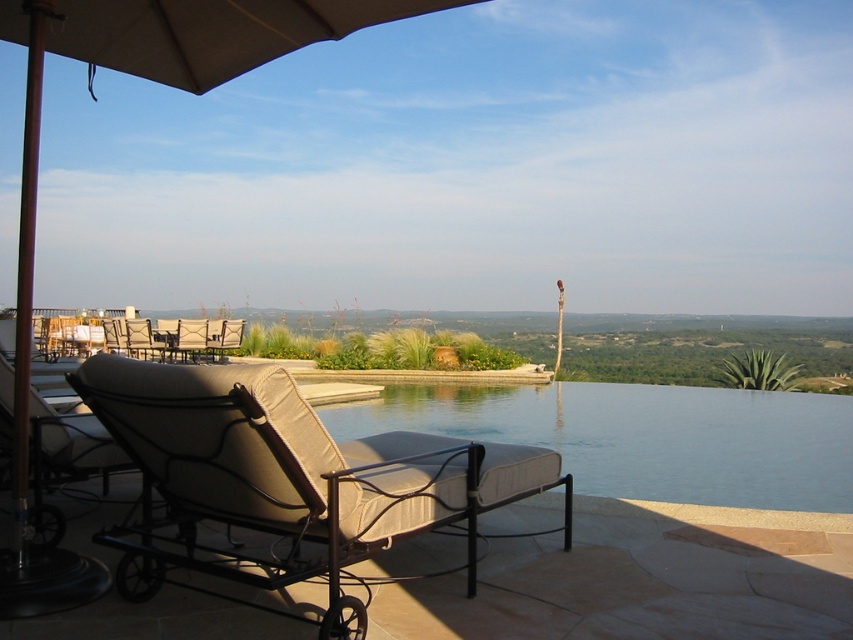
Question: Which of the following is the closest to the observer?

Choices:
 (A) (337, 0)
 (B) (792, 444)

Answer: (A)

Question: Does clear glass water at center have a smaller size compared to beige fabric chair at lower left?

Choices:
 (A) yes
 (B) no

Answer: (B)

Question: Which point appears farthest from the camera in this image?

Choices:
 (A) (502, 458)
 (B) (36, 170)

Answer: (A)

Question: Considering the relative positions of beige fabric chair at upper left and beige fabric chair at lower left in the image provided, where is beige fabric chair at upper left located with respect to beige fabric chair at lower left?

Choices:
 (A) right
 (B) left

Answer: (B)

Question: Which point appears farthest from the camera in this image?

Choices:
 (A) (572, 456)
 (B) (178, 332)
 (C) (241, 333)

Answer: (C)

Question: Does beige fabric umbrella at upper left have a larger size compared to beige fabric chair at center?

Choices:
 (A) no
 (B) yes

Answer: (B)